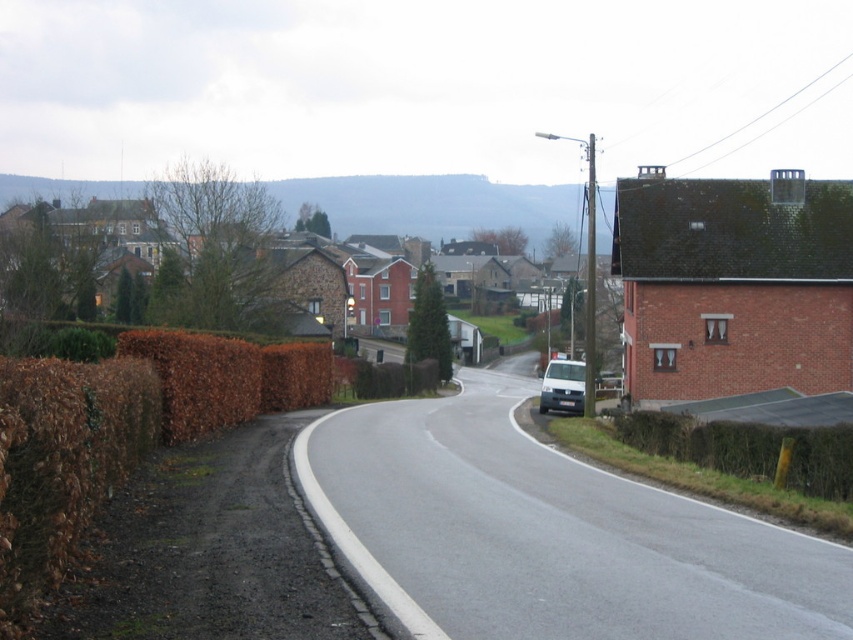
Question: Can you confirm if asphalt road at center is smaller than brown textured hedge at right?

Choices:
 (A) no
 (B) yes

Answer: (A)

Question: Which point is closer to the camera?

Choices:
 (A) asphalt road at center
 (B) white matte van at center
 (C) brown textured hedge at right

Answer: (A)

Question: Can you confirm if brown dry hedge at left is wider than white matte van at center?

Choices:
 (A) no
 (B) yes

Answer: (A)

Question: Among these objects, which one is nearest to the camera?

Choices:
 (A) brown textured hedge at right
 (B) white matte van at center
 (C) brown dry hedge at left

Answer: (C)

Question: Which point is farther from the camera taking this photo?

Choices:
 (A) (86, 472)
 (B) (432, 525)
 (C) (550, 396)
 (D) (807, 474)

Answer: (C)

Question: From the image, what is the correct spatial relationship of asphalt road at center in relation to brown dry hedge at left?

Choices:
 (A) above
 (B) below

Answer: (B)